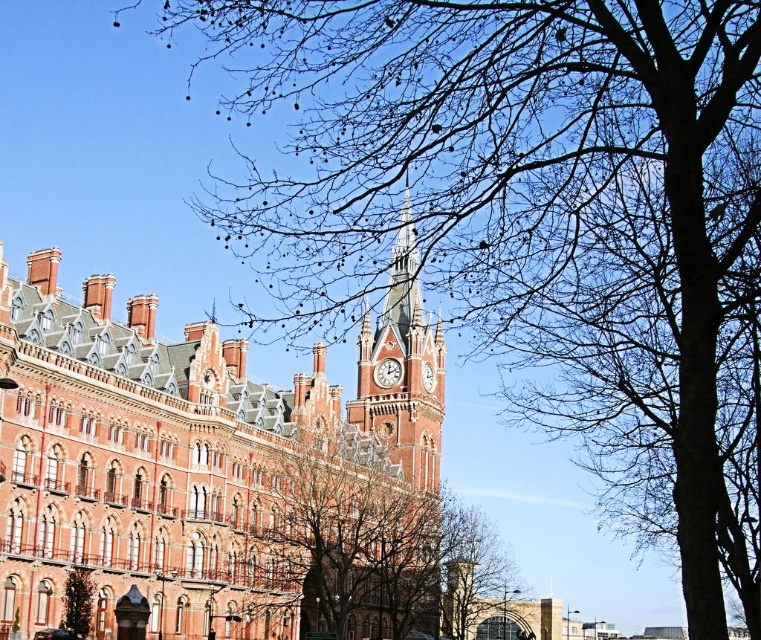
Question: Does bare branches at center have a greater width compared to polished brass clock at center?

Choices:
 (A) yes
 (B) no

Answer: (A)

Question: Among these objects, which one is nearest to the camera?

Choices:
 (A) white glossy clock at center
 (B) polished brass clock at center
 (C) bare branches at center

Answer: (C)

Question: Based on their relative distances, which object is nearer to the white glossy clock at center?

Choices:
 (A) red brick clock tower at center
 (B) polished brass clock at center

Answer: (B)

Question: Can you confirm if red brick clock tower at center is positioned to the left of polished brass clock at center?

Choices:
 (A) yes
 (B) no

Answer: (A)

Question: Which object is positioned closest to the polished brass clock at center?

Choices:
 (A) bare branches at center
 (B) red brick clock tower at center
 (C) white glossy clock at center

Answer: (C)

Question: Where is bare branches at center located in relation to polished brass clock at center in the image?

Choices:
 (A) left
 (B) right

Answer: (B)